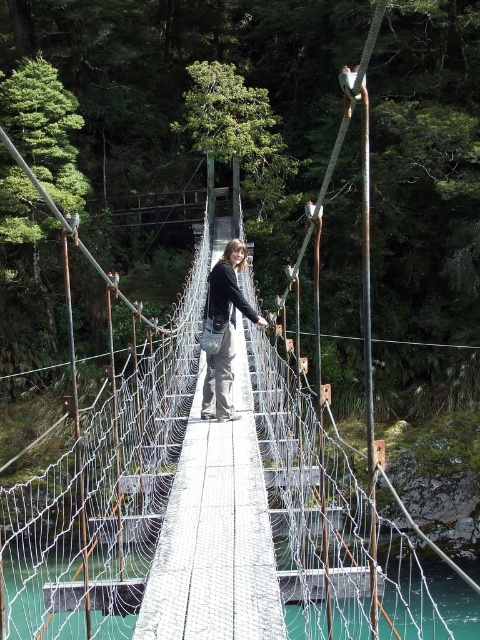
You are a photographer trying to capture the person on the suspension bridge. You notice the matte black jacket at center and the teal glassy water at center. Which object is wider in the image?

The teal glassy water at center is wider than the matte black jacket at center.

You are a photographer wanting to capture the reflection of the matte black jacket at center in the teal glassy water at center. Based on the scene, is the jacket visible in the water?

The matte black jacket at center is in front of teal glassy water at center, so the jacket is blocking its reflection from being seen in the water.

You are a hiker standing on the suspension bridge and want to drop a pebble into the water below. If the pebble falls straight down from the matte black jacket at center, how far will it have to travel to reach the teal glassy water at center?

The distance between the matte black jacket at center and the teal glassy water at center is 10.02 meters, so the pebble will have to travel 10.02 meters to reach the water.